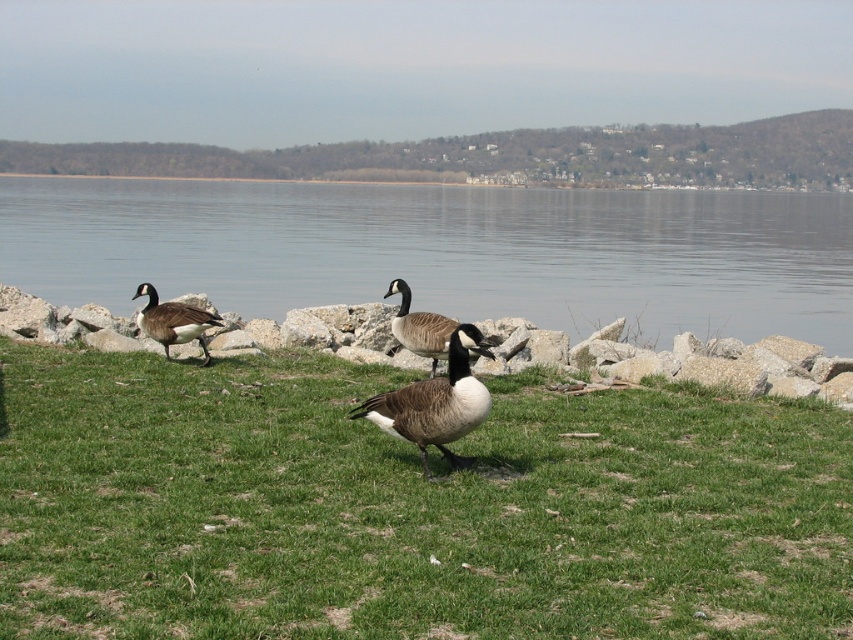
Question: Is smooth gray water at center in front of dark gray matte goose at center?

Choices:
 (A) yes
 (B) no

Answer: (B)

Question: Is gray rock at center bigger than dark gray matte goose at center?

Choices:
 (A) yes
 (B) no

Answer: (A)

Question: Which of these objects is positioned closest to the smooth gray water at center?

Choices:
 (A) brown speckled goose at center
 (B) dark gray matte goose at center
 (C) white glossy duck at center
 (D) gray rock at center

Answer: (D)

Question: Which object is closer to the camera taking this photo?

Choices:
 (A) dark gray matte goose at center
 (B) green grass at center
 (C) smooth gray water at center

Answer: (B)

Question: Is dark gray matte goose at center bigger than brown speckled goose at center?

Choices:
 (A) no
 (B) yes

Answer: (A)

Question: Considering the real-world distances, which object is closest to the white glossy duck at center?

Choices:
 (A) brown speckled goose at center
 (B) dark gray matte goose at center
 (C) smooth gray water at center

Answer: (B)